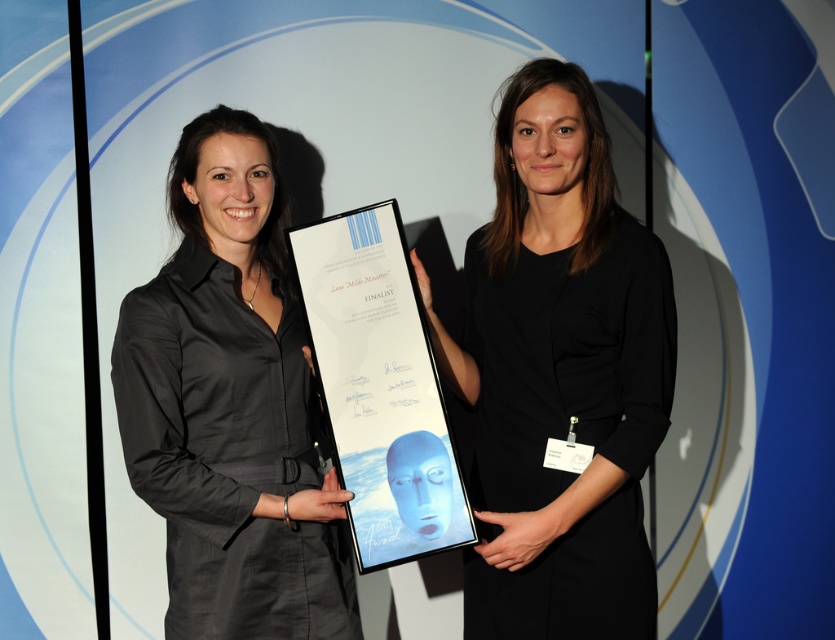
You are a photographer setting up for a group photo. You need to ensure that the matte black dress at center and the white glossy plaque at center are both visible in the frame. Based on their sizes, which object should you focus on first to ensure proper framing?

The matte black dress at center is taller than the white glossy plaque at center, so you should focus on the matte black dress at center first to ensure proper framing since it is larger and requires more attention in the composition.

Based on the photo, you are a photographer trying to capture a clear photo of both dresses. Since you can only focus on one dress at a time, which dress should you focus on first if you want to ensure the black matte dress at center is in focus and the matte black dress at center is slightly blurred?

You should focus on the black matte dress at center first because it is positioned to the right of the matte black dress at center. By focusing on the dress further to the right, the left dress will naturally appear slightly blurred in the photo.

You are a fashion designer observing two women in the image. One is wearing a black matte dress at center and the other a matte black dress at center. Which dress appears taller on the person?

The black matte dress at center appears taller because it has a greater height compared to the matte black dress at center.